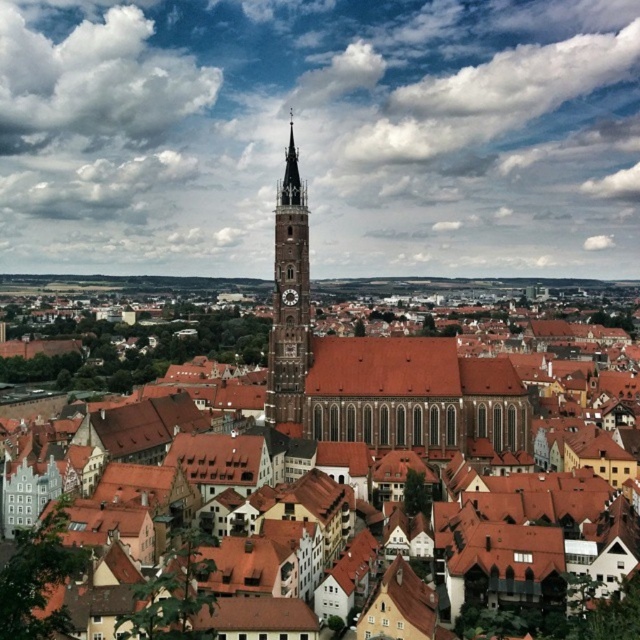
Is point (172, 324) closer to camera compared to point (282, 362)?

No, (172, 324) is further to viewer.

Is brown tiled roof at center to the right of brown stone clock tower at center from the viewer's perspective?

No, brown tiled roof at center is not to the right of brown stone clock tower at center.

Where is `brown tiled roof at center`? This screenshot has width=640, height=640. brown tiled roof at center is located at coordinates point(134,333).

Who is higher up, brown stone clock tower at center or dark brown wooden clock at center?

brown stone clock tower at center is above.

Which is in front, point (282, 420) or point (296, 296)?

Point (296, 296)

Which is behind, point (301, 369) or point (289, 292)?

Point (289, 292)

Find the location of a particular element. The height and width of the screenshot is (640, 640). brown stone clock tower at center is located at coordinates (289, 307).

Is brown tiled roof at center to the left of dark brown wooden clock at center from the viewer's perspective?

Correct, you'll find brown tiled roof at center to the left of dark brown wooden clock at center.

Is brown tiled roof at center taller than dark brown wooden clock at center?

Correct, brown tiled roof at center is much taller as dark brown wooden clock at center.

The image size is (640, 640). Find the location of `brown tiled roof at center`. brown tiled roof at center is located at coordinates (134, 333).